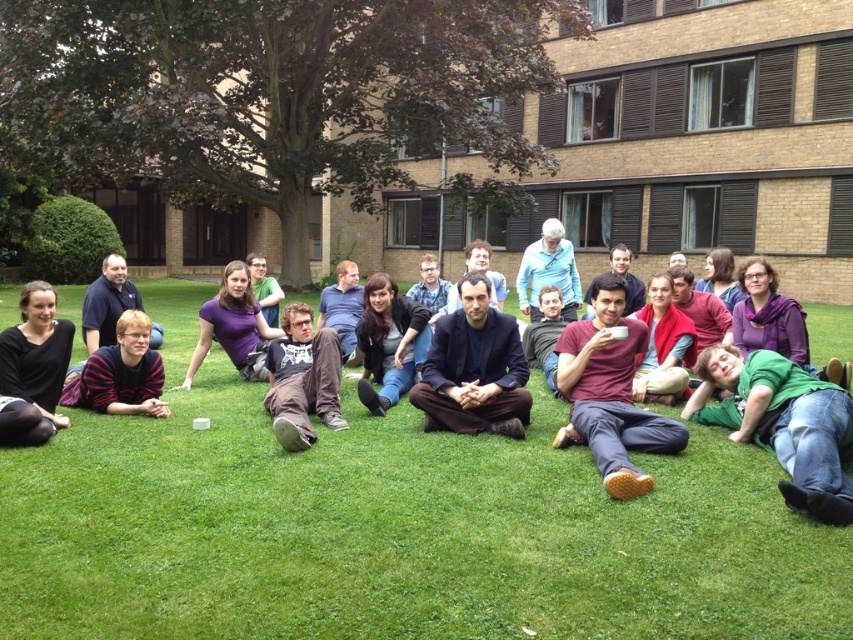
You are standing at the center of the grassy area in the courtyard. There is a point marked at coordinates [474,369]. What is located at that point?

The point at coordinates [474,369] is on the dark blue fabric at center.

You are a photographer trying to capture a group photo of the people in the scene. You need to ensure that all subjects are visible. Given that the striped cotton shirt at lower left and the purple matte shirt at center are at different heights, which subject should you position closer to the camera to ensure their full visibility?

The striped cotton shirt at lower left has a greater height compared to purple matte shirt at center. To ensure full visibility of both subjects, position the purple matte shirt at center closer to the camera since it is shorter and might be obscured by the taller striped cotton shirt at lower left.

You are a photographer trying to capture a candid shot of the group. You notice the brown cotton pants at center and the striped cotton shirt at lower left. Which clothing item is closer to the camera?

The brown cotton pants at center is closer to the camera because it is in front of the striped cotton shirt at lower left.